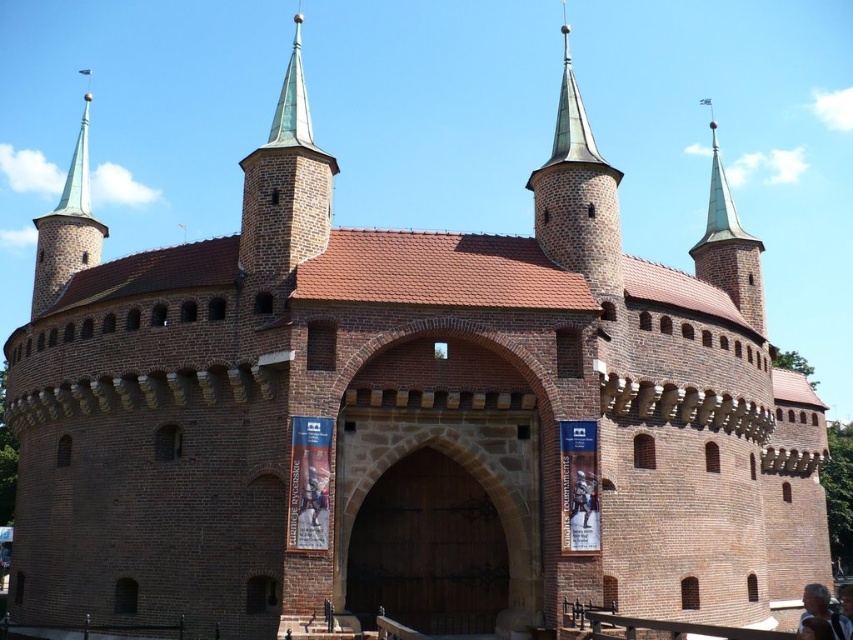
Question: Is brown wooden gate at center bigger than light brown hair at lower right?

Choices:
 (A) no
 (B) yes

Answer: (A)

Question: Among these points, which one is farthest from the camera?

Choices:
 (A) (814, 609)
 (B) (289, 269)

Answer: (B)

Question: Among these points, which one is nearest to the camera?

Choices:
 (A) coord(567,129)
 (B) coord(720,182)
 (C) coord(466,413)

Answer: (C)

Question: Among these points, which one is nearest to the camera?

Choices:
 (A) (705, 275)
 (B) (527, 410)
 (C) (289, 154)

Answer: (B)

Question: Does green copper spire at center appear on the left side of green copper spire at upper left?

Choices:
 (A) yes
 (B) no

Answer: (B)

Question: Is shiny copper spire at upper right positioned before light brown hair at lower right?

Choices:
 (A) no
 (B) yes

Answer: (A)